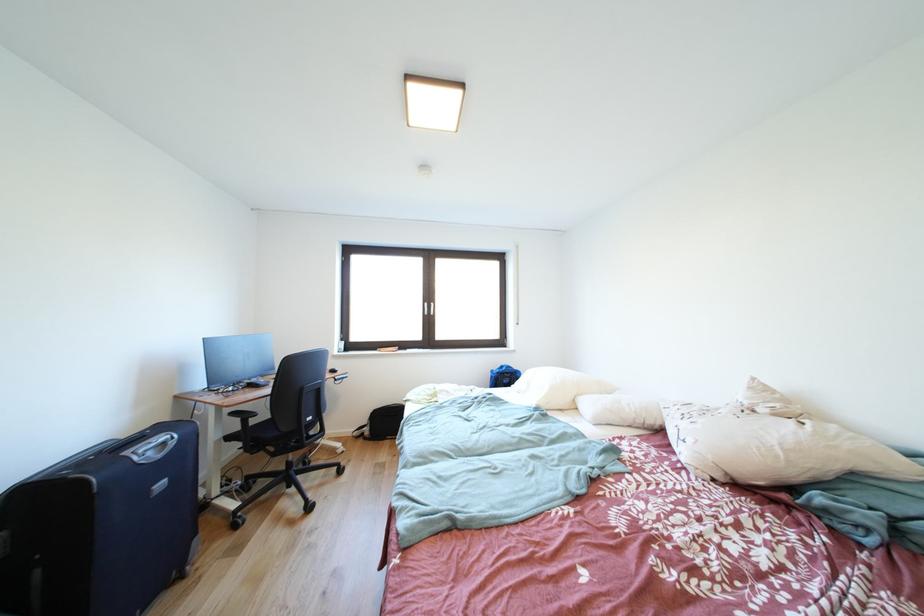
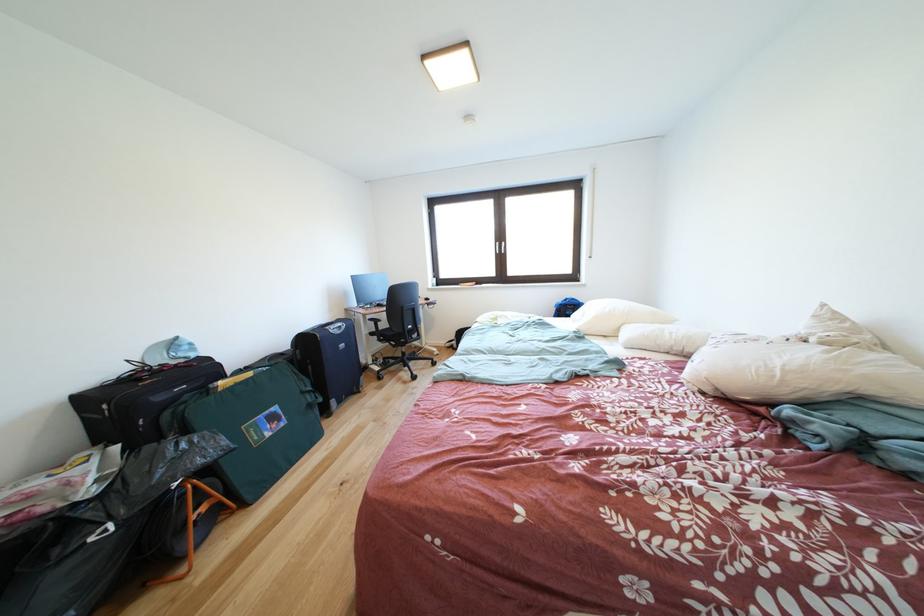
In a continuous first-person perspective shot, in which direction is the camera moving?

The cameraman moved toward right, backward.